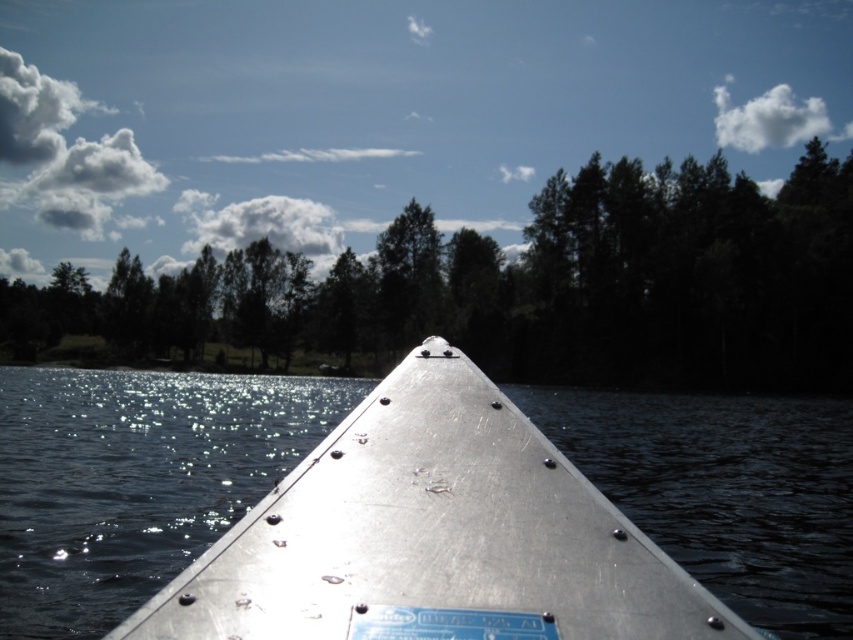
You are an observer on the boat and want to know if the green matte tree at upper center is wider than the metallic boat at center. Can you confirm this?

The green matte tree at upper center is wider than the metallic boat at center according to the description.

You are standing on the deck of the metallic boat at center and looking towards the green matte tree at upper center. Which object is closer to you?

The green matte tree at upper center is closer to you because it is positioned further to the viewer than the metallic boat at center, meaning it appears nearer in the visual perspective.